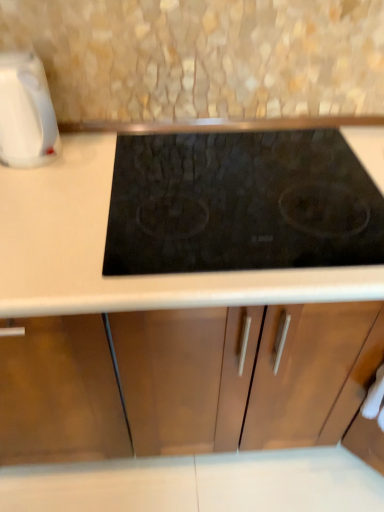
The height and width of the screenshot is (512, 384). What are the coordinates of `free space below white glossy kettle at left (from a real-world perspective)` in the screenshot? It's located at (43, 162).